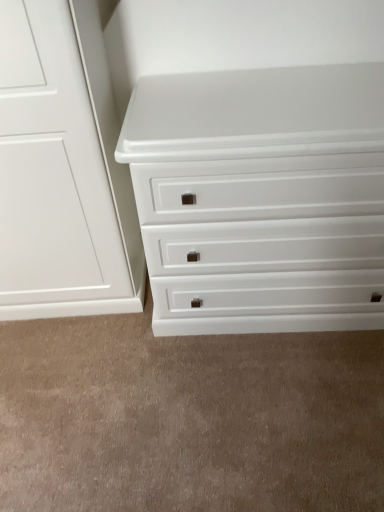
This screenshot has width=384, height=512. I want to click on white matte drawer at lower center, so click(x=188, y=418).

What do you see at coordinates (188, 418) in the screenshot? Image resolution: width=384 pixels, height=512 pixels. I see `white matte drawer at lower center` at bounding box center [188, 418].

I want to click on white glossy chest of drawers at center, so click(261, 198).

This screenshot has height=512, width=384. What do you see at coordinates (261, 198) in the screenshot? I see `white glossy chest of drawers at center` at bounding box center [261, 198].

Where is `white matte drawer at lower center`? The width and height of the screenshot is (384, 512). white matte drawer at lower center is located at coordinates (188, 418).

Consider the image. Considering the relative positions of white glossy chest of drawers at center and white matte drawer at lower center in the image provided, is white glossy chest of drawers at center to the right of white matte drawer at lower center from the viewer's perspective?

Indeed, white glossy chest of drawers at center is positioned on the right side of white matte drawer at lower center.

Which object is more forward, white glossy chest of drawers at center or white matte drawer at lower center?

white glossy chest of drawers at center is more forward.

Is point (162, 141) less distant than point (3, 400)?

Yes.

From the image's perspective, is white glossy chest of drawers at center on top of white matte drawer at lower center?

Correct, white glossy chest of drawers at center appears higher than white matte drawer at lower center in the image.

From a real-world perspective, between white glossy chest of drawers at center and white matte drawer at lower center, who is vertically lower?

white matte drawer at lower center is physically lower.

Considering the relative sizes of white glossy chest of drawers at center and white matte drawer at lower center in the image provided, is white glossy chest of drawers at center thinner than white matte drawer at lower center?

Yes.

Which of these two, white glossy chest of drawers at center or white matte drawer at lower center, stands shorter?

With less height is white matte drawer at lower center.

Between white glossy chest of drawers at center and white matte drawer at lower center, which one has larger size?

Bigger between the two is white glossy chest of drawers at center.

From the picture: Would you say white glossy chest of drawers at center is outside white matte drawer at lower center?

Yes, white glossy chest of drawers at center is outside of white matte drawer at lower center.

Would you consider white glossy chest of drawers at center to be distant from white matte drawer at lower center?

They are positioned close to each other.

Is white glossy chest of drawers at center oriented away from white matte drawer at lower center?

No.

How distant is white glossy chest of drawers at center from white matte drawer at lower center?

white glossy chest of drawers at center is 16.83 inches away from white matte drawer at lower center.

Where is `chest of drawers in front of the white matte drawer at lower center`? chest of drawers in front of the white matte drawer at lower center is located at coordinates point(261,198).

Visually, is white matte drawer at lower center positioned to the left or to the right of white glossy chest of drawers at center?

In the image, white matte drawer at lower center appears on the left side of white glossy chest of drawers at center.

Which object is closer to the camera, white matte drawer at lower center or white glossy chest of drawers at center?

white glossy chest of drawers at center.

Does point (197, 400) appear closer or farther from the camera than point (359, 98)?

Point (197, 400) appears to be farther away from the viewer than point (359, 98).

From the image's perspective, which is above, white matte drawer at lower center or white glossy chest of drawers at center?

From the image's view, white glossy chest of drawers at center is above.

From a real-world perspective, who is located higher, white matte drawer at lower center or white glossy chest of drawers at center?

From a 3D spatial view, white glossy chest of drawers at center is above.

Considering the sizes of objects white matte drawer at lower center and white glossy chest of drawers at center in the image provided, who is thinner, white matte drawer at lower center or white glossy chest of drawers at center?

Thinner between the two is white glossy chest of drawers at center.

Which of these two, white matte drawer at lower center or white glossy chest of drawers at center, stands taller?

With more height is white glossy chest of drawers at center.

Can you confirm if white matte drawer at lower center is bigger than white glossy chest of drawers at center?

Actually, white matte drawer at lower center might be smaller than white glossy chest of drawers at center.

From the picture: Is white matte drawer at lower center situated inside white glossy chest of drawers at center or outside?

white matte drawer at lower center is not enclosed by white glossy chest of drawers at center.

From the picture: Are white matte drawer at lower center and white glossy chest of drawers at center far apart?

No, white matte drawer at lower center is in close proximity to white glossy chest of drawers at center.

Is white matte drawer at lower center aimed at white glossy chest of drawers at center?

Yes, white matte drawer at lower center is facing white glossy chest of drawers at center.

Can you tell me how much white matte drawer at lower center and white glossy chest of drawers at center differ in facing direction?

The angle between the facing direction of white matte drawer at lower center and the facing direction of white glossy chest of drawers at center is 179 degrees.

Where is `plain on the left of white glossy chest of drawers at center`? Image resolution: width=384 pixels, height=512 pixels. plain on the left of white glossy chest of drawers at center is located at coordinates (188, 418).

Where is `plain below the white glossy chest of drawers at center (from a real-world perspective)`? plain below the white glossy chest of drawers at center (from a real-world perspective) is located at coordinates (188, 418).

Find the location of a particular element. This screenshot has height=512, width=384. plain that appears behind the white glossy chest of drawers at center is located at coordinates (188, 418).